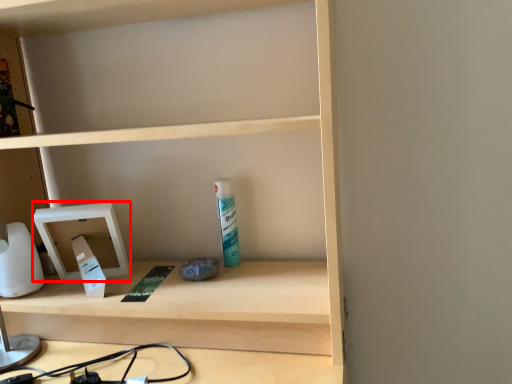
Question: From the image, what is the correct spatial relationship of medicine cabinet (annotated by the red box) in relation to toiletry?

Choices:
 (A) left
 (B) right

Answer: (A)